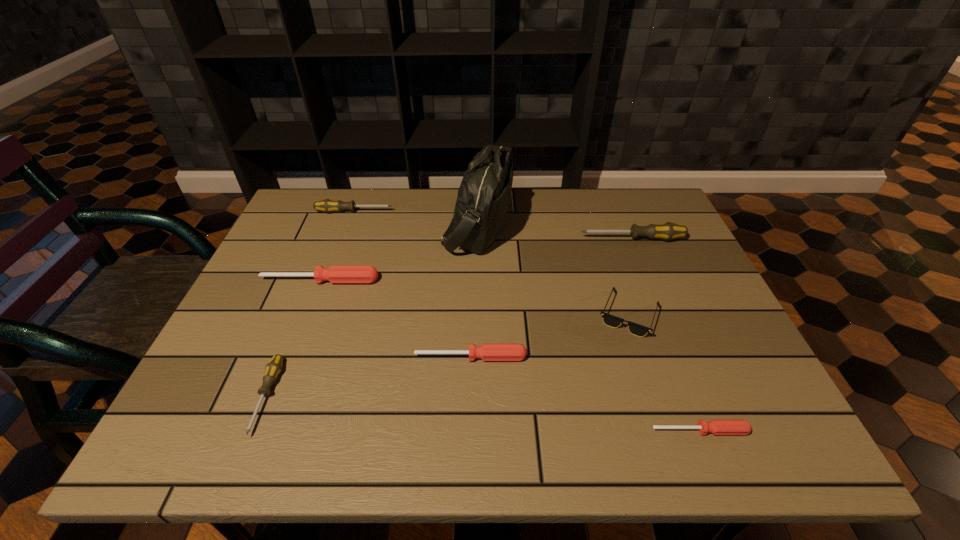
I want to click on the second biggest red screwdriver, so click(x=487, y=352).

The height and width of the screenshot is (540, 960). Find the location of `the nearest gray screwdriver`. the nearest gray screwdriver is located at coordinates coord(274,367).

Image resolution: width=960 pixels, height=540 pixels. I want to click on the shortest object, so click(716, 426).

Find the location of a particular element. The height and width of the screenshot is (540, 960). the nearest red screwdriver is located at coordinates (716, 426).

Identify the location of free space located 0.090m at the front padded panel of the tallest object. (542, 225).

Locate an element on the screen. free space located at the tip of the tallest screwdriver is located at coordinates (463, 239).

Locate an element on the screen. vacant space located at the tip of the tallest screwdriver is located at coordinates click(526, 239).

At what (x,y) coordinates should I click in order to perform the action: click on vacant area located 0.100m at the tip of the tallest screwdriver. Please return your answer as a coordinate pair (x, y). Image resolution: width=960 pixels, height=540 pixels. Looking at the image, I should click on (544, 239).

This screenshot has width=960, height=540. In order to click on vacant position located at the tip of the second smallest gray screwdriver in this screenshot , I will do `click(413, 212)`.

I want to click on free space located 0.170m on the front of the biggest red screwdriver, so click(298, 339).